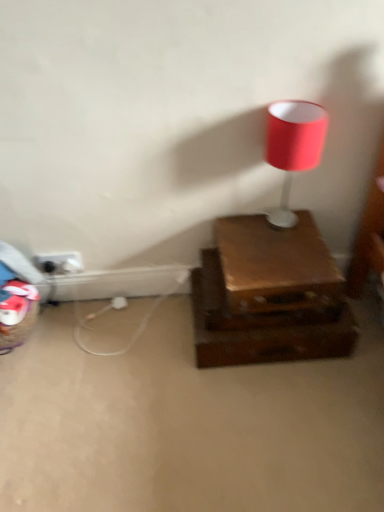
Locate an element on the screen. The height and width of the screenshot is (512, 384). vacant space to the left of matte red lampshade at upper right is located at coordinates (238, 228).